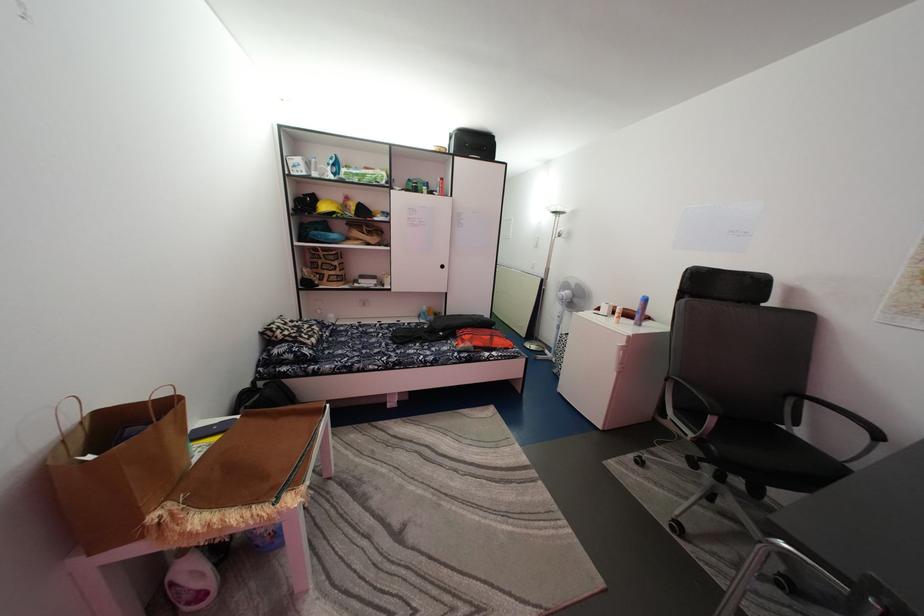
Locate an element on the screen. This screenshot has height=616, width=924. white fridge handle is located at coordinates (619, 355).